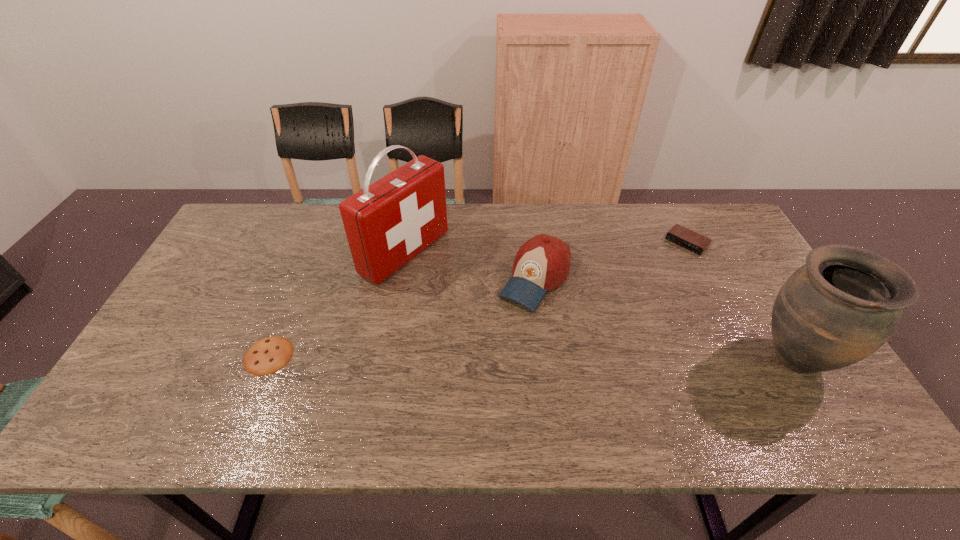
Identify the location of vacant region located on the front-facing side of the baseball cap. [x=509, y=321].

Locate an element on the screen. The width and height of the screenshot is (960, 540). vacant point located 0.300m on the front-facing side of the baseball cap is located at coordinates (458, 390).

I want to click on vacant space located on the front-facing side of the baseball cap, so click(x=484, y=355).

At what (x,y) coordinates should I click in order to perform the action: click on vacant space situated on the front face of the tallest object. Please return your answer as a coordinate pair (x, y). The image size is (960, 540). Looking at the image, I should click on (495, 307).

Find the location of a particular element. free point located 0.230m on the front face of the tallest object is located at coordinates (498, 309).

Identify the location of free spot located on the front face of the tallest object. (467, 291).

The image size is (960, 540). I want to click on free space located on the front face of the fourth tallest object, so click(x=624, y=307).

The height and width of the screenshot is (540, 960). I want to click on vacant space located 0.320m on the front face of the fourth tallest object, so coord(624,307).

This screenshot has width=960, height=540. I want to click on free space located 0.090m on the front face of the fourth tallest object, so click(x=663, y=267).

I want to click on baseball cap present at the far edge, so click(542, 263).